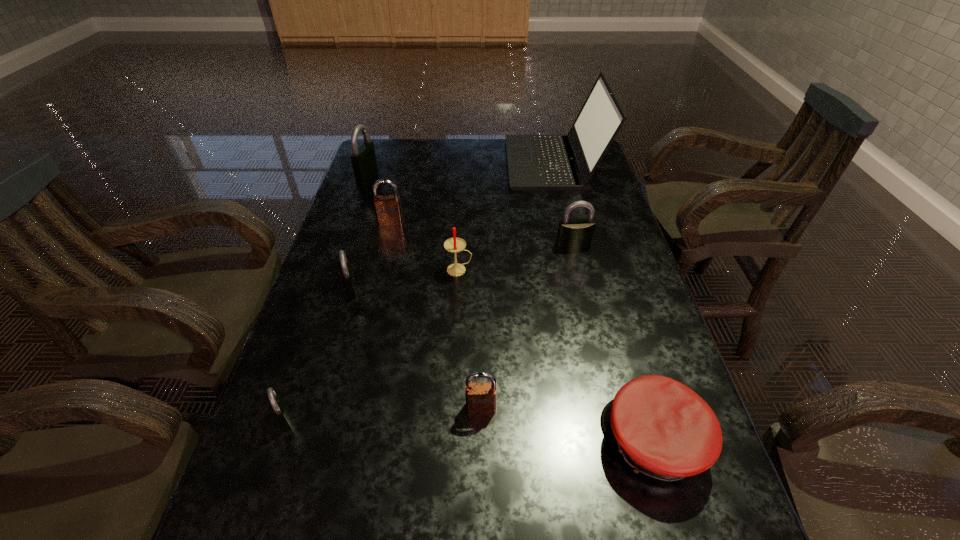
Find the location of a particular element. the fourth farthest padlock is located at coordinates (346, 271).

At what (x,y) coordinates should I click in order to perform the action: click on the nearer brown padlock. Please return your answer as a coordinate pair (x, y). The image size is (960, 540). Looking at the image, I should click on tap(480, 397).

This screenshot has width=960, height=540. I want to click on the right brown padlock, so click(480, 397).

This screenshot has width=960, height=540. I want to click on cap, so click(x=663, y=429).

Image resolution: width=960 pixels, height=540 pixels. Identify the location of the shortest padlock. (280, 411).

Where is `the nearest black padlock`? This screenshot has height=540, width=960. the nearest black padlock is located at coordinates (280, 411).

Identify the location of vacant space located on the surface of the tallest object. This screenshot has height=540, width=960. (476, 163).

At what (x,y) coordinates should I click in order to perform the action: click on vacant space located 0.080m on the surface of the tallest object. Please return your answer as a coordinate pair (x, y). Looking at the image, I should click on (485, 163).

Find the location of `vacant space located 0.110m on the surface of the tallest object`. vacant space located 0.110m on the surface of the tallest object is located at coordinates (476, 163).

Locate an element on the screen. This screenshot has height=540, width=960. vacant space positioned 0.060m on the back of the biggest black padlock is located at coordinates (373, 158).